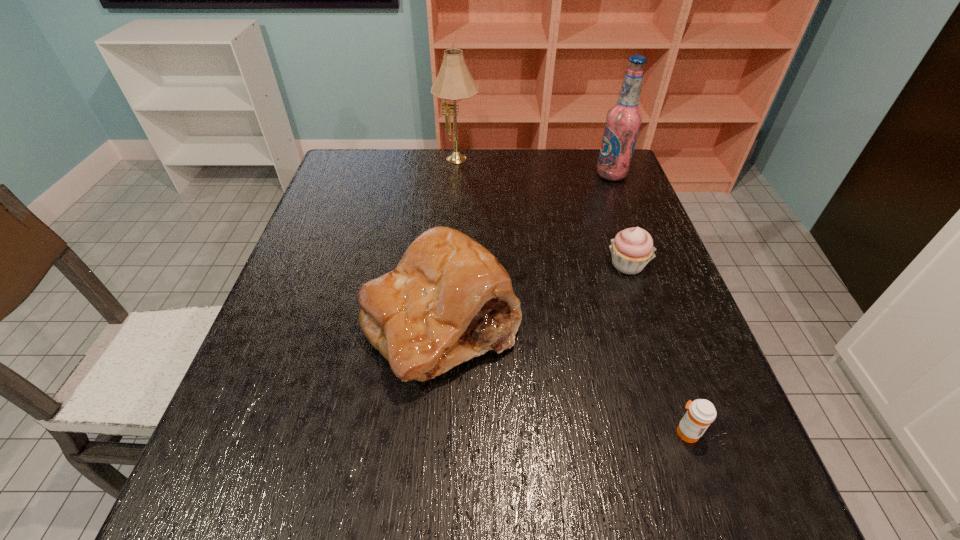
Image resolution: width=960 pixels, height=540 pixels. Identify the location of lampshade. (454, 82).

At what (x,y) coordinates should I click in order to perform the action: click on alcohol. Please return your answer as a coordinate pair (x, y). Looking at the image, I should click on (623, 121).

You are a GUI agent. You are given a task and a screenshot of the screen. Output one action in this format:
    pyautogui.click(x=<x>, y=<y>)
    Task: Click on the third tallest object
    
    Given the screenshot: What is the action you would take?
    pyautogui.click(x=448, y=300)

Find the location of a particular element. The height and width of the screenshot is (540, 960). cupcake is located at coordinates (632, 248).

Locate an element on the screen. The width and height of the screenshot is (960, 540). medicine is located at coordinates (701, 413).

The width and height of the screenshot is (960, 540). In order to click on the shortest object in this screenshot , I will do `click(701, 413)`.

In order to click on free space located 0.130m on the right of the lampshade in this screenshot , I will do `click(519, 161)`.

Locate an element on the screen. vacant area situated on the back of the alcohol is located at coordinates (605, 158).

Locate an element on the screen. This screenshot has height=540, width=960. vacant region located on the filling side of the bread is located at coordinates (424, 537).

Where is `free region located 0.400m on the front of the cupcake`? The width and height of the screenshot is (960, 540). free region located 0.400m on the front of the cupcake is located at coordinates (690, 448).